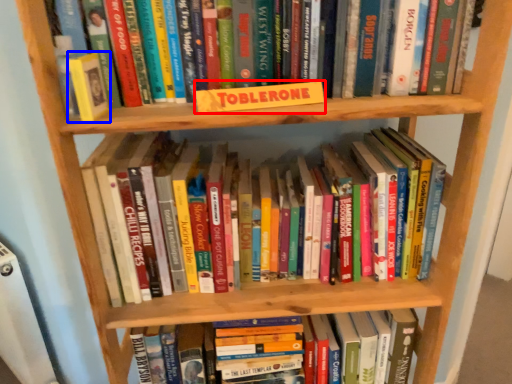
Question: Among these objects, which one is nearest to the camera, paperback book (highlighted by a red box) or paperback book (highlighted by a blue box)?

Choices:
 (A) paperback book
 (B) paperback book

Answer: (B)